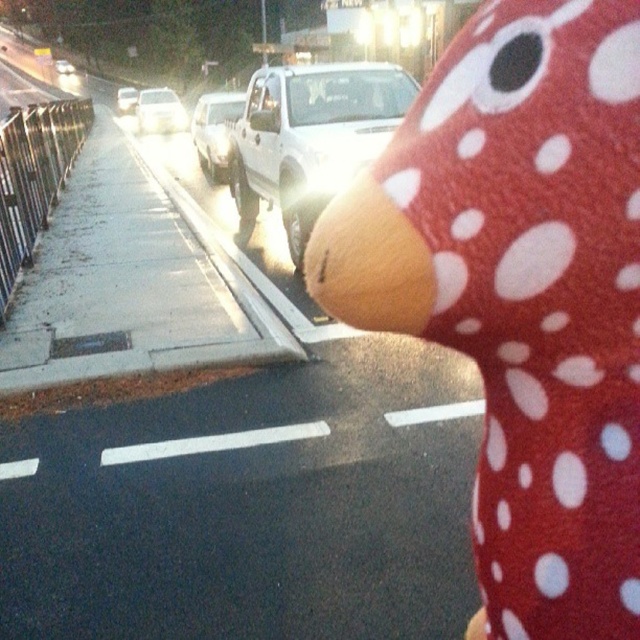
You are a pedestrian standing on the sidewalk next to the road. You see the white matte truck at center and the white glossy car at upper left. Which vehicle is positioned to the right side of the other?

The white matte truck at center is positioned to the right of the white glossy car at upper left.